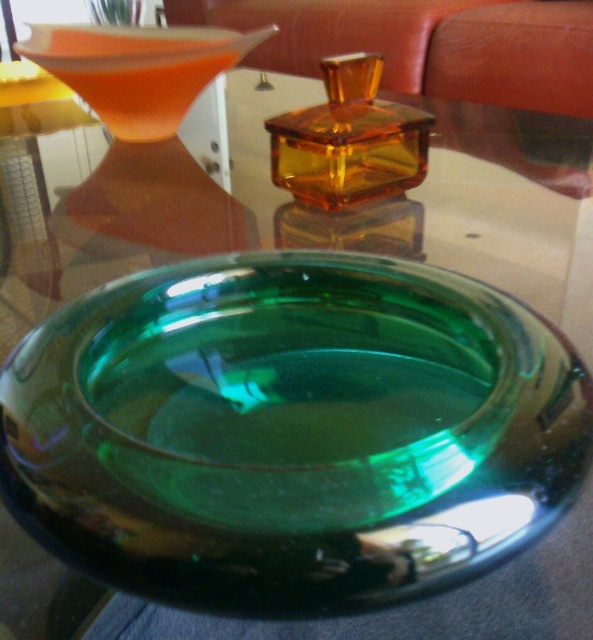
You are arranging items on a reflective glass table and see the translucent amber glass at upper left and the amber glass perfume at center. Which item is positioned closer to you?

The translucent amber glass at upper left is closer to the viewer than the amber glass perfume at center.

You are arranging items on a glass table and see the translucent amber glass at upper left and the amber glass perfume at center. Which object is wider?

The translucent amber glass at upper left is wider than the amber glass perfume at center.